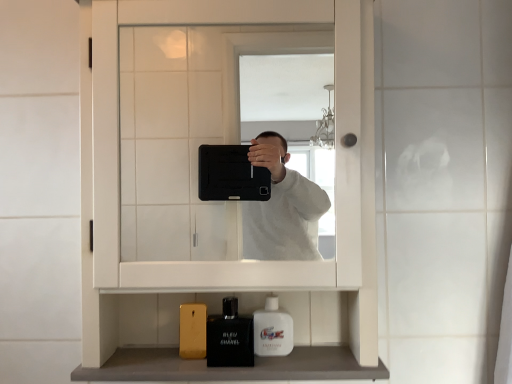
The height and width of the screenshot is (384, 512). Identify the location of vacant space situated above smooth gray countertop at lower center (from a real-world perspective). (224, 345).